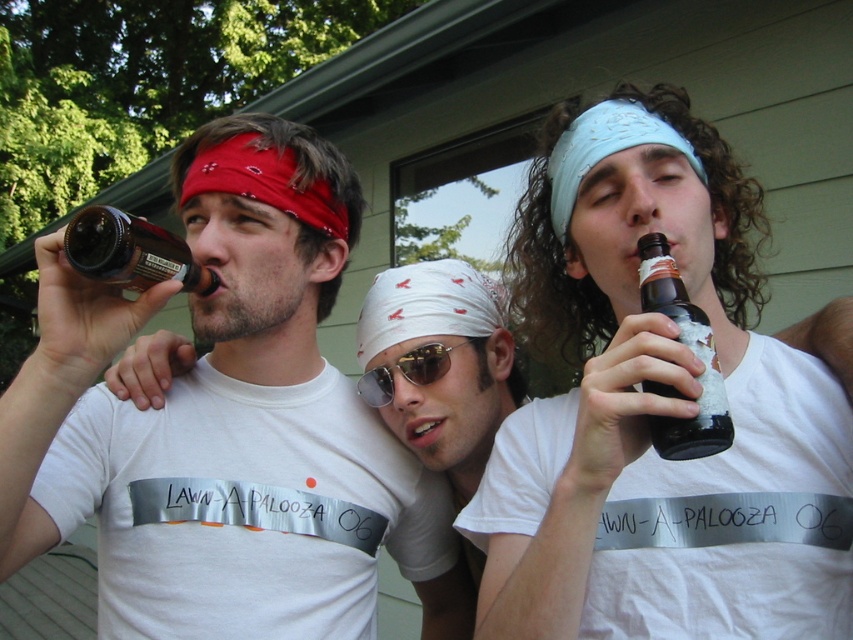
Question: Can you confirm if matte brown glass bottle at left is positioned above sunglasses at center?

Choices:
 (A) yes
 (B) no

Answer: (A)

Question: Does matte black bottle at left appear on the right side of matte brown glass bottle at left?

Choices:
 (A) yes
 (B) no

Answer: (A)

Question: Based on their relative distances, which object is farther from the matte black bottle at left?

Choices:
 (A) dark brown glass bottle at right
 (B) matte brown glass bottle at left

Answer: (A)

Question: Which point is farther to the camera?

Choices:
 (A) sunglasses at center
 (B) matte black bottle at center

Answer: (A)

Question: Is matte black bottle at center smaller than matte brown glass bottle at left?

Choices:
 (A) yes
 (B) no

Answer: (B)

Question: Which object appears farthest from the camera in this image?

Choices:
 (A) matte brown glass bottle at left
 (B) dark brown glass bottle at right

Answer: (A)